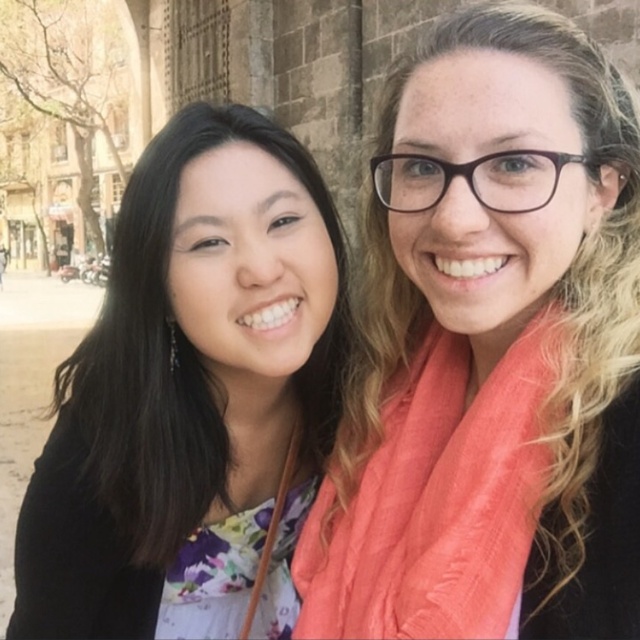
Question: Which of these objects is positioned farthest from the floral fabric dress at center?

Choices:
 (A) coral silk scarf at right
 (B) coral scarf at right

Answer: (A)

Question: Is coral scarf at right above coral silk scarf at right?

Choices:
 (A) no
 (B) yes

Answer: (B)

Question: Which of the following is the farthest from the observer?

Choices:
 (A) (529, 394)
 (B) (211, 440)
 (C) (483, 26)

Answer: (B)

Question: Can you confirm if floral fabric dress at center is bigger than coral silk scarf at right?

Choices:
 (A) no
 (B) yes

Answer: (B)

Question: Is floral fabric dress at center bigger than coral silk scarf at right?

Choices:
 (A) no
 (B) yes

Answer: (B)

Question: Which point is closer to the camera?

Choices:
 (A) coral silk scarf at right
 (B) coral scarf at right
 (C) floral fabric dress at center

Answer: (B)